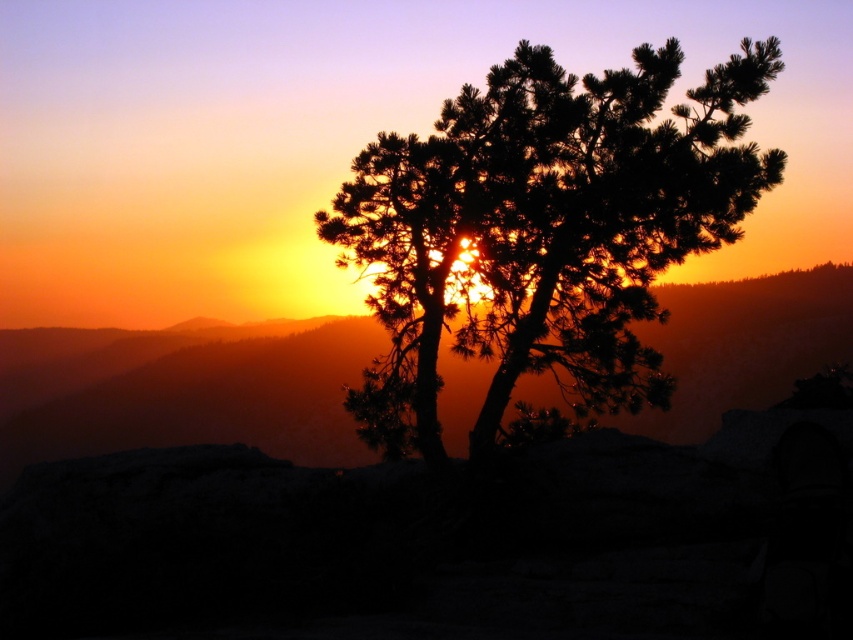
Consider the image. Is silhouette pine at center taller than matte orange mountain at center?

Indeed, silhouette pine at center has a greater height compared to matte orange mountain at center.

Does point (641, 288) lie behind point (838, 307)?

That is False.

You are a GUI agent. You are given a task and a screenshot of the screen. Output one action in this format:
    pyautogui.click(x=<x>, y=<y>)
    Task: Click on the silhouette pine at center
    
    Given the screenshot: What is the action you would take?
    pyautogui.click(x=543, y=230)